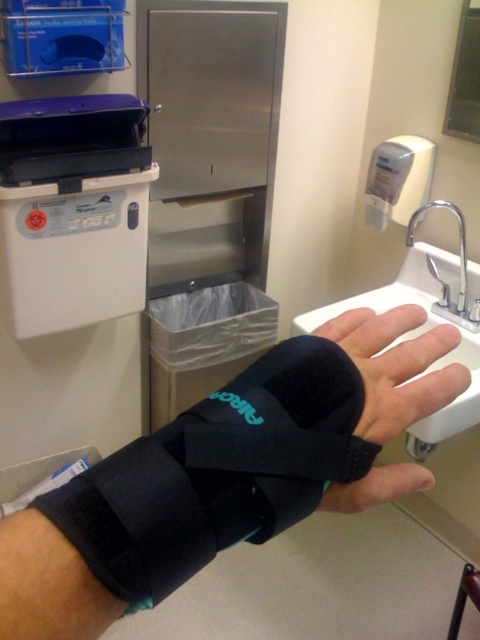
You are a nurse preparing to wash your hands in the clinical area shown. You notice the black neoprene wristband at center and the silver metallic faucet at upper right. Which object is closer to you as you face the sink?

The black neoprene wristband at center is closer to you because it is in front of the silver metallic faucet at upper right.

You are a patient in a hospital bathroom and need to wash your hands. The white ceramic sink at center and the matte gray plastic hand dryer at upper right are both available. Which one should you use for washing your hands?

The white ceramic sink at center should be used for washing hands since it is larger than the matte gray plastic hand dryer at upper right, indicating it is designed for hand washing purposes.

You are a healthcare worker in a clinical area. You need to wash your hands before proceeding. You see the white ceramic sink at center and the matte gray plastic hand dryer at upper right. Which object should you use first?

The white ceramic sink at center should be used first because it is to the left of the matte gray plastic hand dryer at upper right, and handwashing typically occurs before using a hand dryer in a clinical setting.